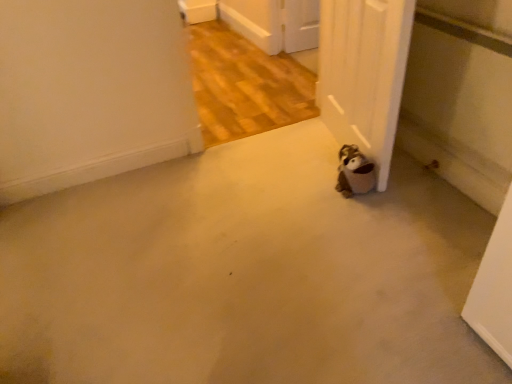
Locate an element on the screen. Image resolution: width=512 pixels, height=384 pixels. spots to the right of brown plush toy at lower right is located at coordinates (401, 191).